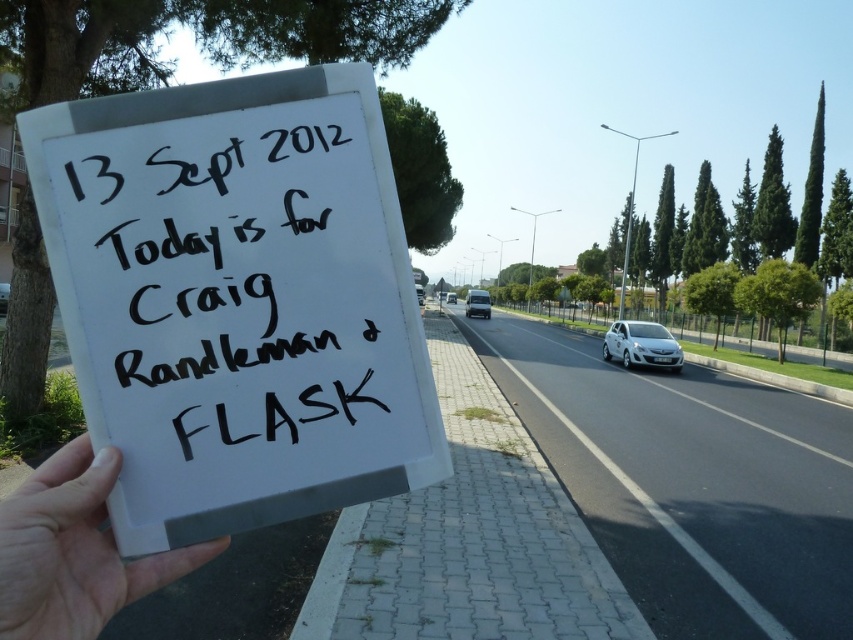
You are a pedestrian standing on the sidewalk. You see the white plastic sign at center and the white glossy car at center. Which object is nearer to you?

The white plastic sign at center is closer to the viewer than the white glossy car at center.

You are a pedestrian standing on the sidewalk and want to cross the road to reach the white matte van at center. Is the white metallic car at right blocking your path?

The white metallic car at right is in front of the white matte van at center, so it is blocking the path to the van.

You are a delivery driver who needs to park your white plastic van at center in a parking spot that is exactly the width of a white matte van at center. Will your van fit in the spot?

The white matte van at center is wider than the white plastic van at center, so the white plastic van at center will fit into the parking spot designed for the white matte van at center.